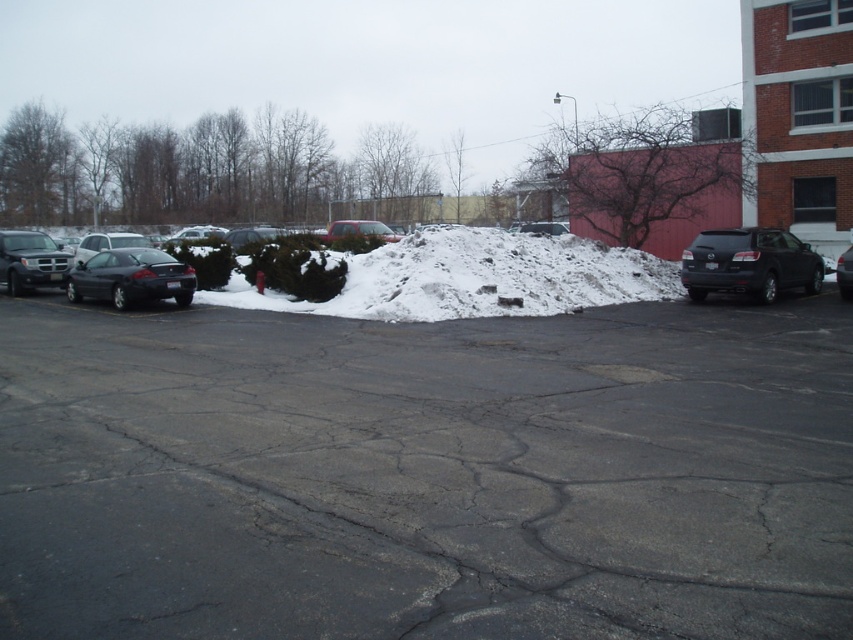
Question: Based on their relative distances, which object is farther from the black asphalt parking lot at center?

Choices:
 (A) matte black truck at left
 (B) matte black car at center
 (C) black glossy sedan at right
 (D) shiny black sedan at left

Answer: (A)

Question: Considering the real-world distances, which object is farthest from the matte red sedan at center?

Choices:
 (A) black glossy sedan at right
 (B) white snow at center
 (C) shiny black sedan at left
 (D) black asphalt parking lot at center

Answer: (A)

Question: Is the position of black asphalt parking lot at center more distant than that of matte red sedan at center?

Choices:
 (A) no
 (B) yes

Answer: (A)

Question: Can you confirm if black asphalt parking lot at center is thinner than white snow at center?

Choices:
 (A) yes
 (B) no

Answer: (B)

Question: Can you confirm if matte black suv at right is wider than black glossy sedan at right?

Choices:
 (A) no
 (B) yes

Answer: (A)

Question: Which of these objects is positioned closest to the matte black truck at left?

Choices:
 (A) shiny black sedan at left
 (B) black glossy sedan at right
 (C) shiny silver sedan at left
 (D) matte black suv at right

Answer: (C)